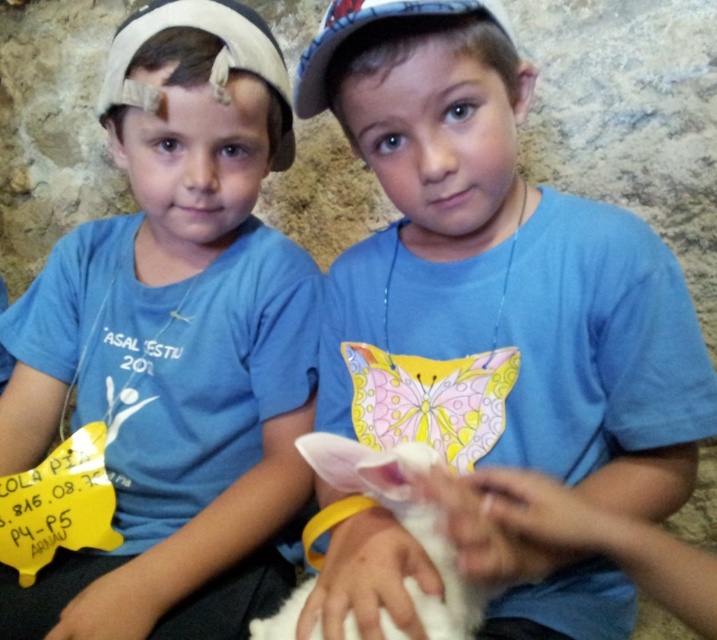
You are a photographer standing at point (371, 33). You want to take a photo of the two boys and the animal. The minimum distance required for your camera to focus properly is 25 inches. Will you be able to capture them clearly?

The two boys are 24.55 inches apart, which is less than the minimum focusing distance of 25 inches. Therefore, the camera may not focus properly, and capturing them clearly might be difficult.

You are standing at the origin point in the image. Which of the two points, point (403, 611) or point (262, 627), is closer to you?

Point (403, 611) is closer to you because it is in front of point (262, 627).

You are a photographer trying to capture a clear photo of the white fluffy rabbit at center. However, the blue matte shirt at center is blocking your view. Can you determine if the rabbit is still visible through the shirt?

The blue matte shirt at center is positioned over white fluffy rabbit at center, so the rabbit is completely blocked and not visible through the shirt.